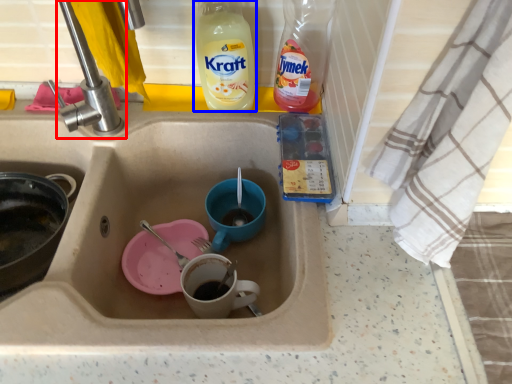
Question: Which object is closer to the camera taking this photo, tap (highlighted by a red box) or drink (highlighted by a blue box)?

Choices:
 (A) tap
 (B) drink

Answer: (A)